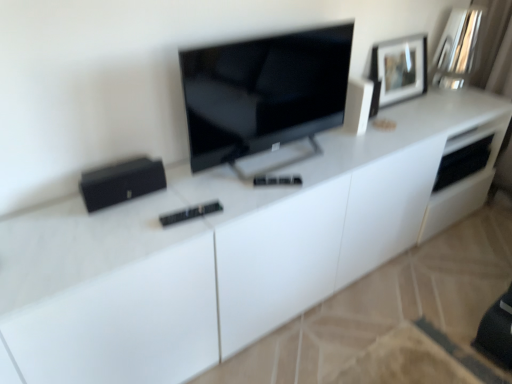
You are a GUI agent. You are given a task and a screenshot of the screen. Output one action in this format:
    pyautogui.click(x=<x>, y=<y>)
    Task: Click on the vacant area that lies to the right of white glossy speaker at upper right, which is counted as the 1th appliance, starting from the top
    The image size is (512, 384).
    Given the screenshot: What is the action you would take?
    pyautogui.click(x=391, y=130)